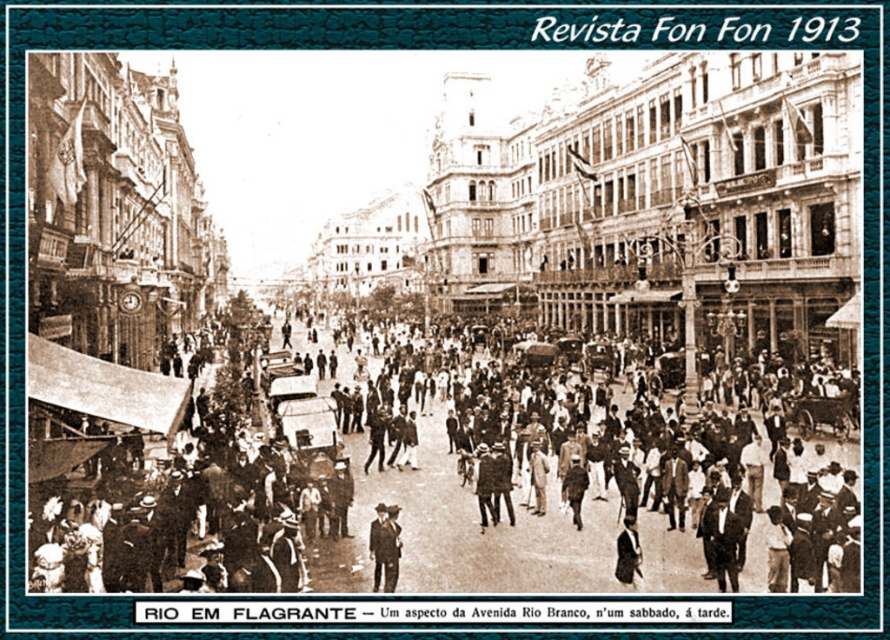
In the photograph from 1913, you notice two men wearing suits in the center of the image. One is wearing a dark brown suit at center and the other a dark suit at center. Which man is closer to the camera?

The dark brown suit at center is closer to the camera because it is in front of the dark suit at center.

Based on the photo, you are a photographer in 1913 Rio de Janeiro, standing on Avenida Rio Branco. You notice two men wearing suits at the center of the scene. The first man wears a dark brown suit at center, and the second man wears a dark suit at center. Which man appears taller in the photograph?

The dark brown suit at center appears taller than the dark suit at center in the photograph.

In the sepia photograph from 1913 titled Revista Fon Fon, which shows a busy Avenida Rio Branco in Rio de Janeiro, there is a point marked at coordinates (x=462, y=486). What object is located at this point?

The point at coordinates (x=462, y=486) is located on the dark brown suit at center.